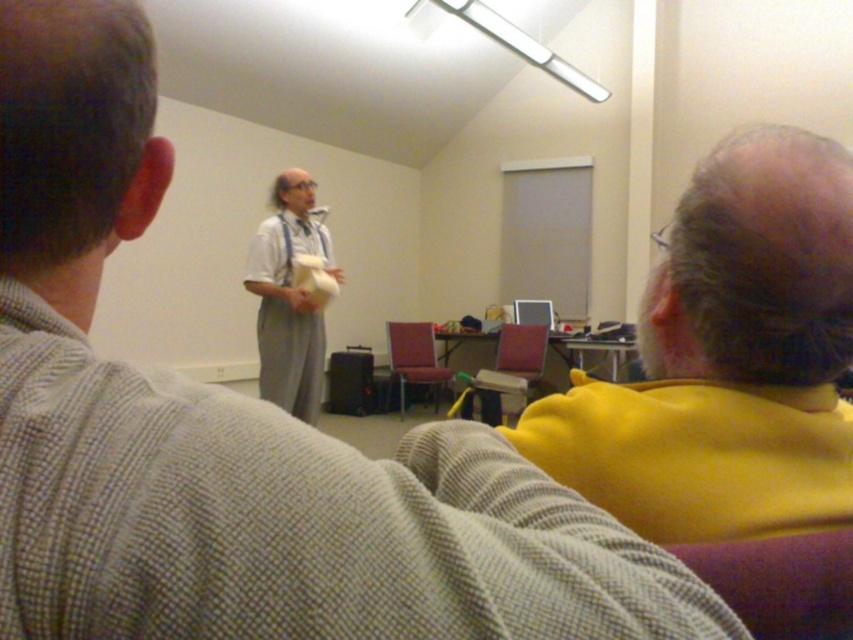
You are organizing a fashion show and need to know if the light gray fabric dress at center can be displayed on the matte plastic chair at center. Based on their positions, is the dress already placed on the chair?

The light gray fabric dress at center is positioned over matte plastic chair at center, so yes, the dress is already placed on the chair.